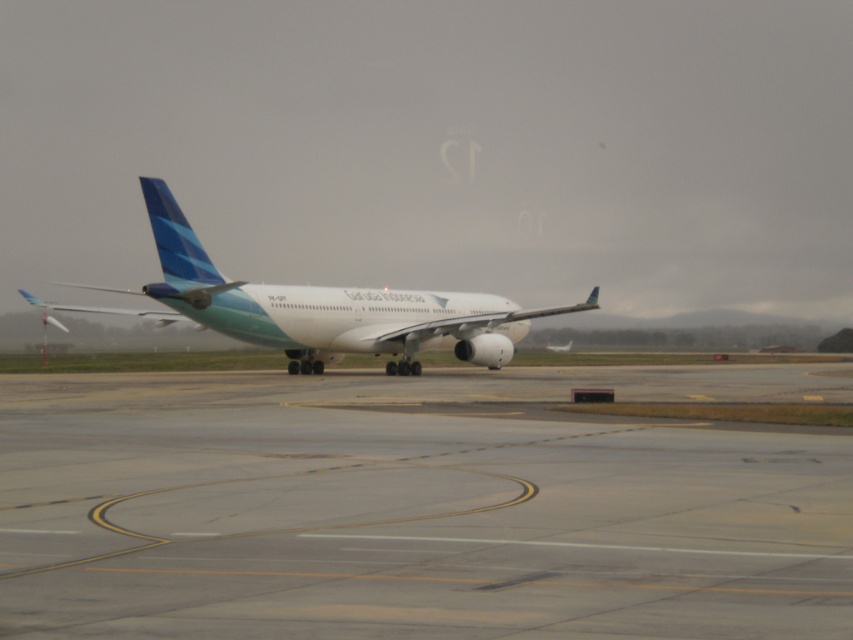
Consider the image. You are a pilot preparing for takeoff. You need to ensure the white glossy airplane at center is properly aligned with the gray asphalt runway at center. Based on the scene description, is the airplane currently positioned correctly for takeoff? Explain your reasoning.

The gray asphalt runway at center is positioned on the right side of the white glossy airplane at center. This means the airplane is not centered on the runway, which is a critical requirement for safe takeoff. Proper alignment requires the airplane to be centered between the runway edges, so the current positioning is incorrect.

You are a pilot standing on the gray asphalt runway at center. You see the white glossy airplane at center in front of you. Can you walk directly towards the airplane without stepping off the runway?

The gray asphalt runway at center is closer to the viewer than the white glossy airplane at center, so you can walk directly towards the airplane without stepping off the runway since it is on the same runway surface.

You are a pilot preparing to land a plane that requires a runway width of 50 meters. The gray asphalt runway at center is the only available runway. Can the white glossy airplane at center safely land here?

The gray asphalt runway at center is narrower than the white glossy airplane at center, so it may not be wide enough to safely accommodate the landing of the airplane. The pilot should seek an alternative runway with sufficient width.